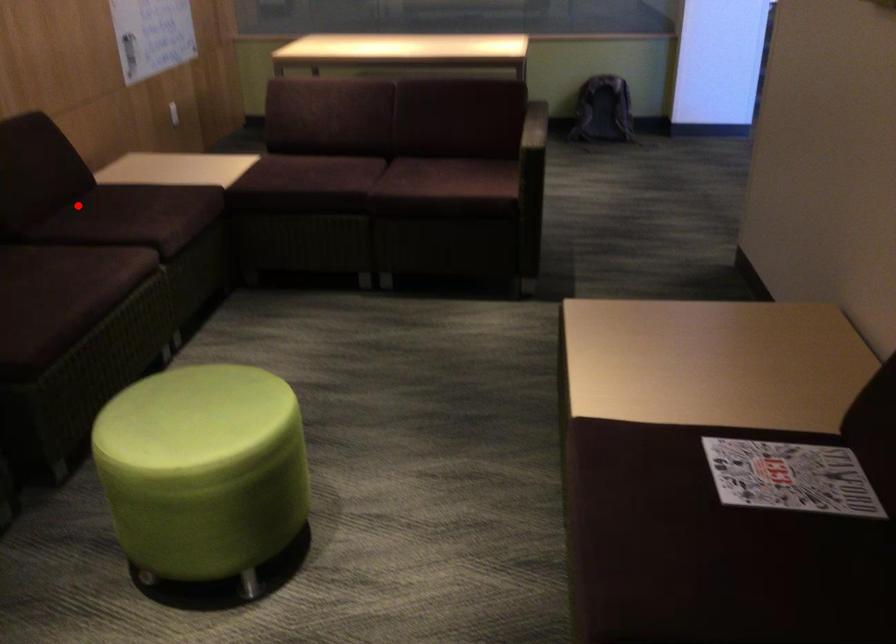
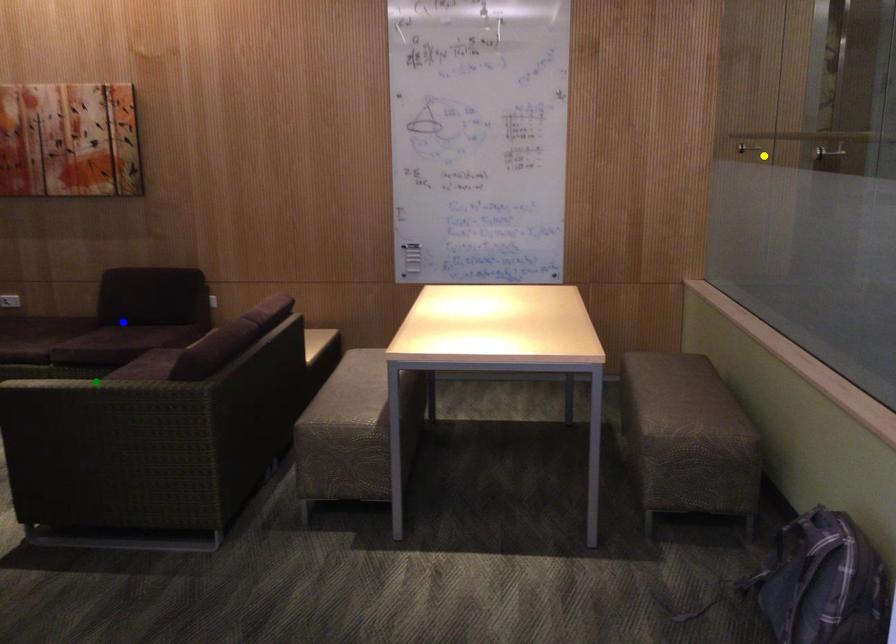
Question: I am providing you with two images of the same scene from different viewpoints. A red point is marked on the first image. You are given multiple points on the second image. In image 2, which mark is for the same physical point as the one in image 1?

Choices:
 (A) yellow point
 (B) green point
 (C) blue point

Answer: (C)